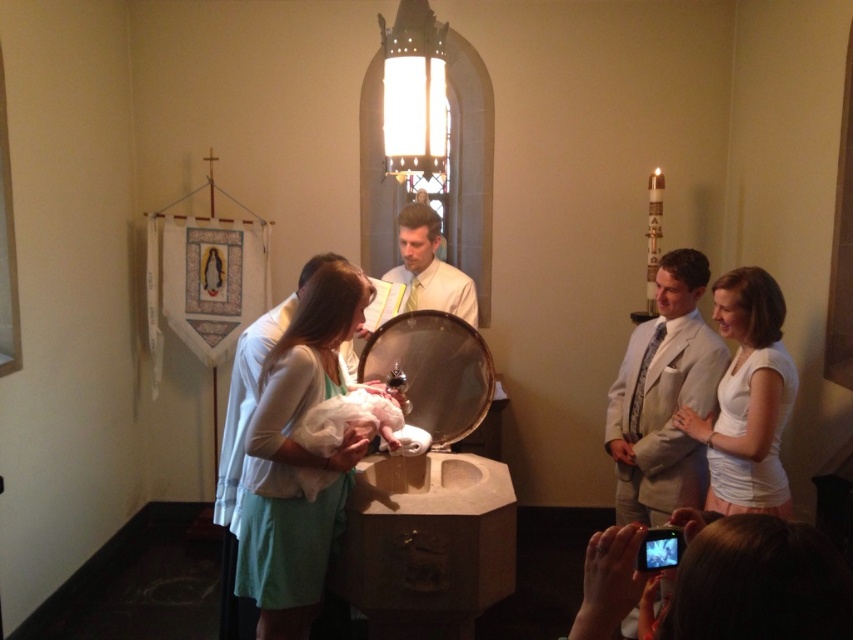
Question: Among these points, which one is nearest to the camera?

Choices:
 (A) (627, 380)
 (B) (312, 321)

Answer: (B)

Question: Which object is the farthest from the white cotton shirt at right?

Choices:
 (A) white textured suit at right
 (B) light green fabric dress at center

Answer: (B)

Question: Estimate the real-world distances between objects in this image. Which object is farther from the white textured suit at right?

Choices:
 (A) white cotton shirt at right
 (B) white glossy shirt at center
 (C) light green fabric dress at center

Answer: (C)

Question: Does white textured suit at right appear over white cotton shirt at right?

Choices:
 (A) no
 (B) yes

Answer: (A)

Question: Is white textured suit at right below white glossy shirt at center?

Choices:
 (A) no
 (B) yes

Answer: (B)

Question: Is the position of light green fabric dress at center less distant than that of white cotton shirt at right?

Choices:
 (A) yes
 (B) no

Answer: (A)